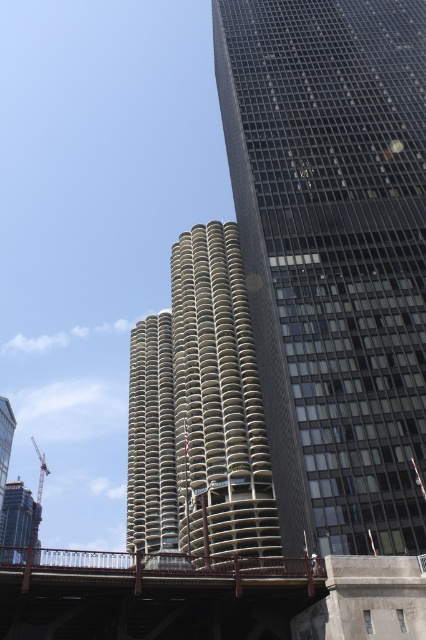
Is metallic gray crane at lower left shorter than metallic safety harness at lower center?

In fact, metallic gray crane at lower left may be taller than metallic safety harness at lower center.

Who is positioned more to the right, metallic gray crane at lower left or metallic safety harness at lower center?

From the viewer's perspective, metallic safety harness at lower center appears more on the right side.

I want to click on metallic gray crane at lower left, so click(x=37, y=500).

Does dark gray concrete building at lower left have a lesser width compared to metallic gray crane at lower left?

Yes, dark gray concrete building at lower left is thinner than metallic gray crane at lower left.

Is dark gray concrete building at lower left wider than metallic gray crane at lower left?

No.

Where is `dark gray concrete building at lower left`? This screenshot has width=426, height=640. dark gray concrete building at lower left is located at coordinates (16, 522).

Where is `dark gray concrete building at lower left`? dark gray concrete building at lower left is located at coordinates (16, 522).

Which is above, beige concrete tower at center or metallic gray crane at lower left?

beige concrete tower at center is above.

Who is more distant from viewer, (137,497) or (37,550)?

Point (137,497)

The image size is (426, 640). What are the coordinates of `beige concrete tower at center` in the screenshot? It's located at (152, 438).